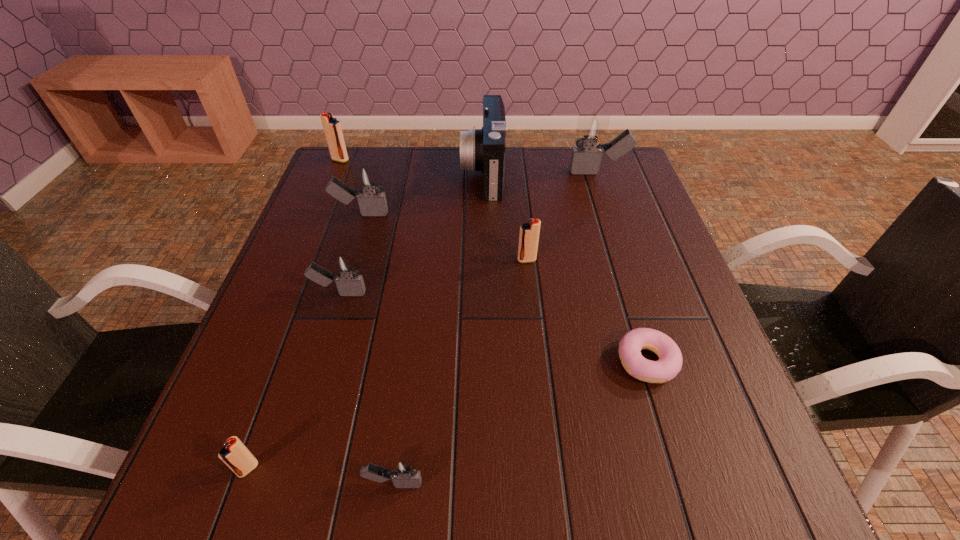
Where is `the second nearest red igniter`? The width and height of the screenshot is (960, 540). the second nearest red igniter is located at coordinates (529, 232).

The width and height of the screenshot is (960, 540). Identify the location of the fifth nearest object. (529, 232).

Locate an element on the screen. Image resolution: width=960 pixels, height=540 pixels. the nearest red igniter is located at coordinates 234,454.

The height and width of the screenshot is (540, 960). I want to click on the smallest red igniter, so click(x=234, y=454).

This screenshot has height=540, width=960. Identify the location of the third igniter from right to left. (404, 474).

Find the location of `the smallest gray igniter`. the smallest gray igniter is located at coordinates (404, 474).

At what (x,y) coordinates should I click in order to perform the action: click on pink doughnut. Please return your answer as a coordinate pair (x, y). Looking at the image, I should click on (669, 364).

Identify the location of the seventh farthest object. (669, 364).

You are a GUI agent. You are given a task and a screenshot of the screen. Output one action in this format:
    pyautogui.click(x=<x>, y=<y>)
    Task: Click on the free spot located 0.060m on the lens of the camcorder
    The height and width of the screenshot is (540, 960).
    Given the screenshot: What is the action you would take?
    pyautogui.click(x=441, y=172)

At what (x,y) coordinates should I click in order to perform the action: click on vacant area located 0.220m on the lens of the camcorder. Please return your answer as a coordinate pair (x, y). The height and width of the screenshot is (540, 960). Looking at the image, I should click on (387, 172).